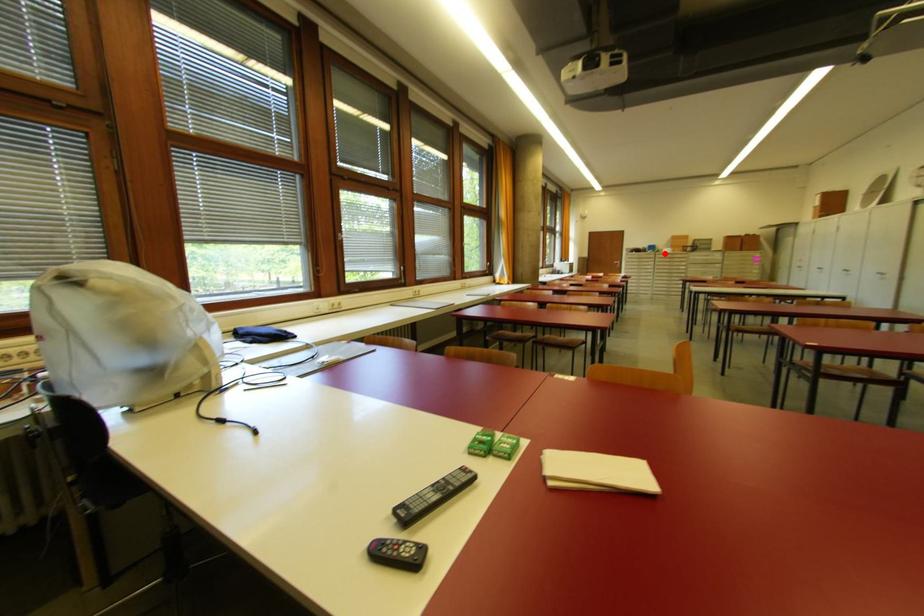
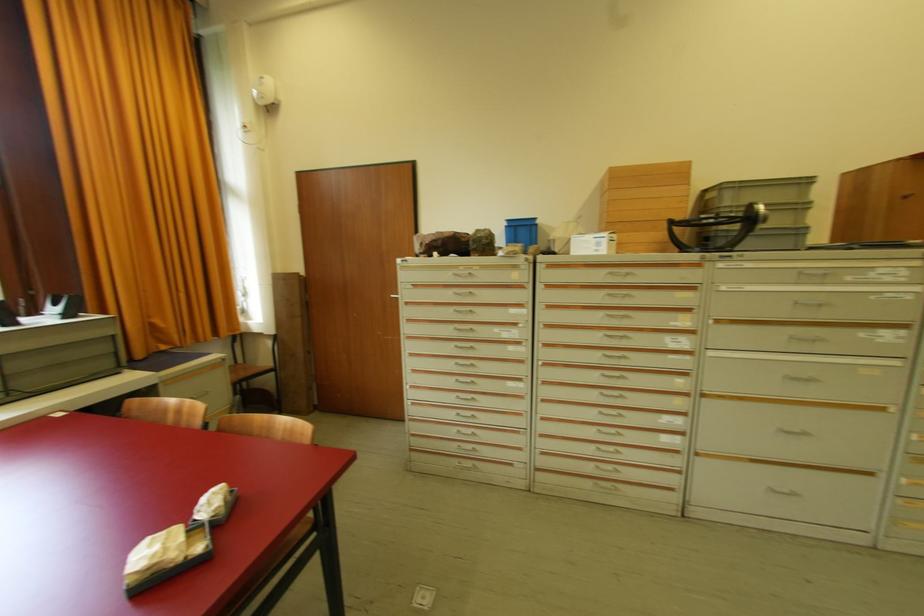
Question: I am providing you with two images of the same scene from different viewpoints. A red point is shown in image1. For the corresponding object point in image2, is it positioned nearer or farther from the camera?

Choices:
 (A) Nearer
 (B) Farther

Answer: (B)